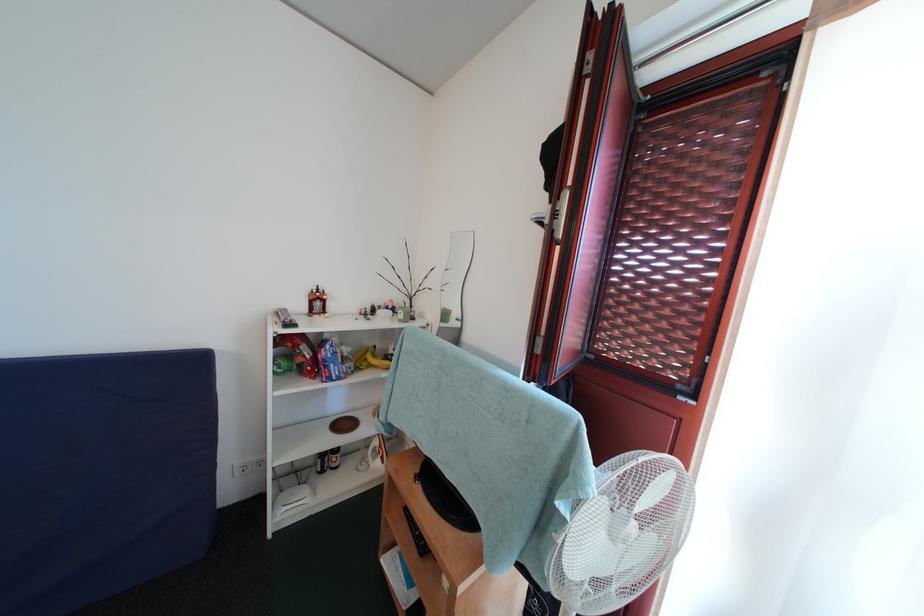
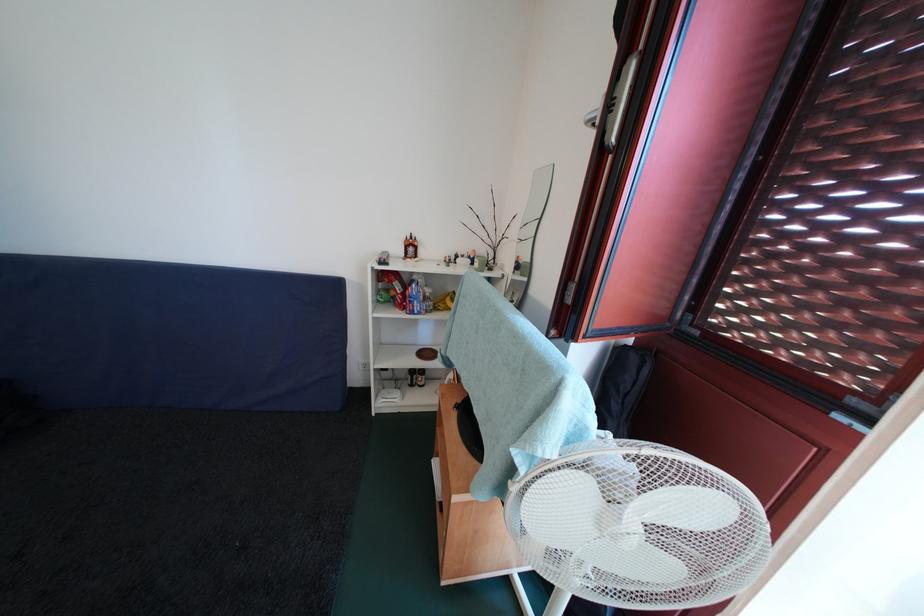
Question: The images are taken continuously from a first-person perspective. In which direction are you moving?

Choices:
 (A) Left
 (B) Right
 (C) Forward
 (D) Backward

Answer: (B)